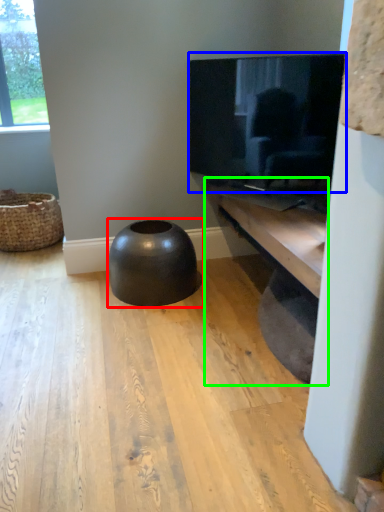
Question: Estimate the real-world distances between objects in this image. Which object is closer to stool (highlighted by a red box), television (highlighted by a blue box) or shelf (highlighted by a green box)?

Choices:
 (A) television
 (B) shelf

Answer: (B)